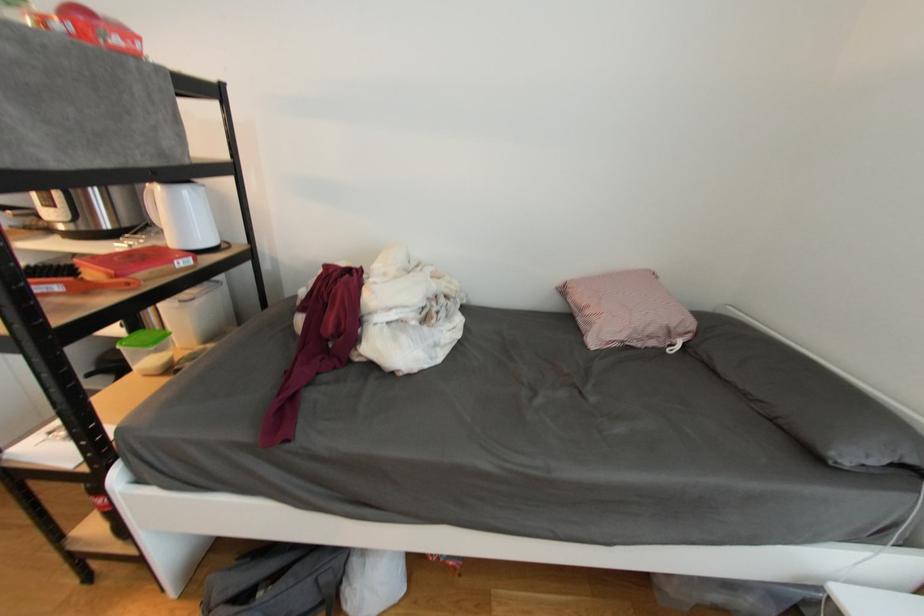
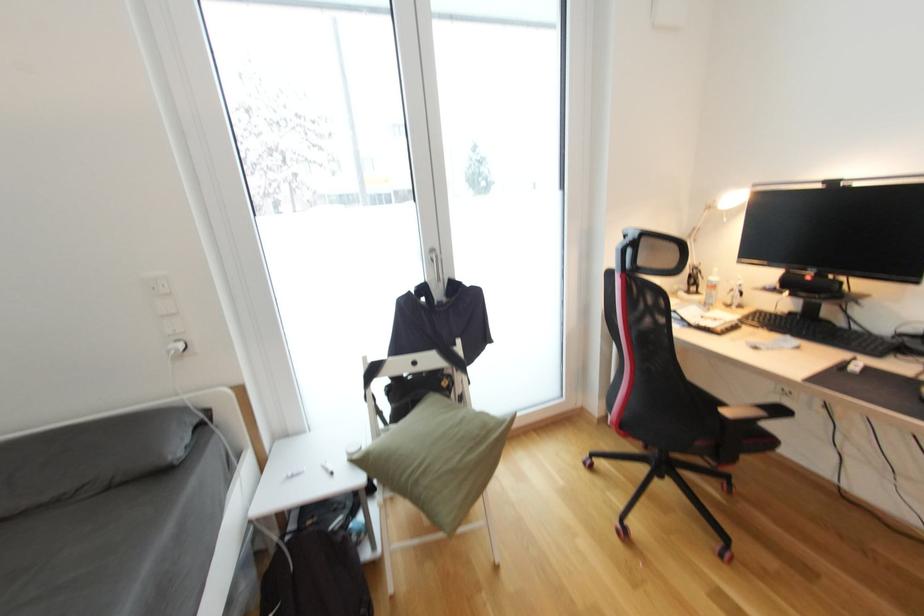
The first image is from the beginning of the video and the second image is from the end. How did the camera likely rotate when shooting the video?

The rotation direction of the camera is right-down.